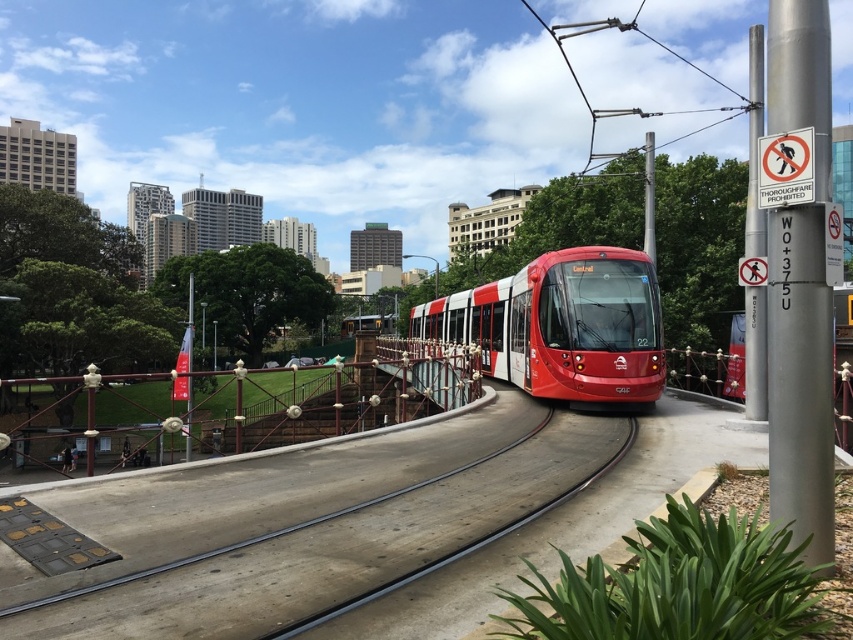
Question: Which point appears closest to the camera in this image?

Choices:
 (A) (653, 362)
 (B) (608, 464)

Answer: (B)

Question: Does shiny red tram at center come in front of smooth concrete train track at center?

Choices:
 (A) yes
 (B) no

Answer: (B)

Question: Does shiny red tram at center appear on the left side of smooth concrete train track at center?

Choices:
 (A) no
 (B) yes

Answer: (A)

Question: Is shiny red tram at center wider than smooth concrete train track at center?

Choices:
 (A) yes
 (B) no

Answer: (B)